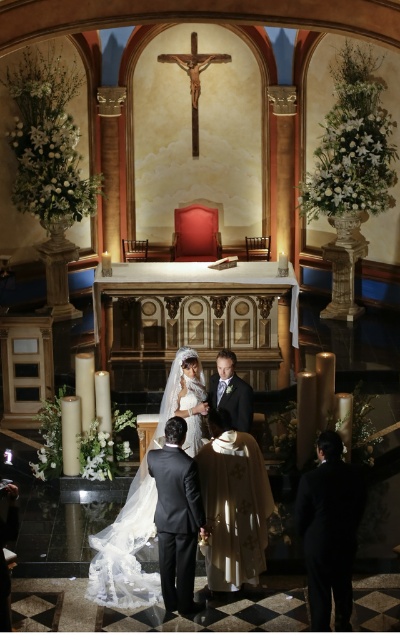
Question: Is dark gray suit at center above satin white dress at center?

Choices:
 (A) yes
 (B) no

Answer: (B)

Question: Is satin white dress at center behind shiny black suit at center?

Choices:
 (A) no
 (B) yes

Answer: (A)

Question: Which point appears closest to the camera in this image?

Choices:
 (A) (335, 483)
 (B) (181, 360)
 (C) (200, 387)
 (D) (229, 358)

Answer: (A)

Question: Which point is closer to the camera taking this photo?

Choices:
 (A) (110, 545)
 (B) (185, 493)

Answer: (B)

Question: Which point is closer to the camera?

Choices:
 (A) dark gray suit at center
 (B) shiny black suit at center
 (C) white lace veil at center
 (D) satin white dress at center

Answer: (A)

Question: Does black suit at lower right appear over shiny black suit at center?

Choices:
 (A) no
 (B) yes

Answer: (A)